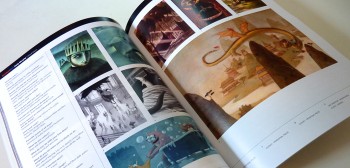
This screenshot has width=350, height=168. I want to click on the right side of open book, so click(x=247, y=59).